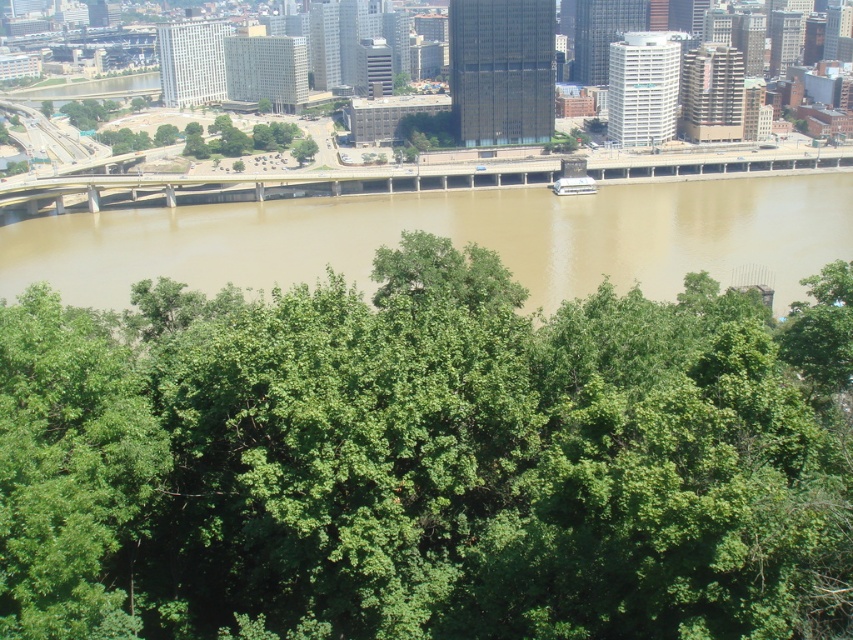
Does point (281, 596) come in front of point (691, 179)?

Yes, it is in front of point (691, 179).

Can you confirm if green leafy tree at center is shorter than brown concrete bridge at center?

Incorrect, green leafy tree at center's height does not fall short of brown concrete bridge at center's.

Does point (556, 490) lie behind point (378, 180)?

That is False.

The width and height of the screenshot is (853, 640). What are the coordinates of `green leafy tree at center` in the screenshot? It's located at (427, 460).

Who is lower down, brown muddy water at center or brown concrete bridge at center?

brown muddy water at center is lower down.

Does brown muddy water at center have a lesser width compared to brown concrete bridge at center?

Indeed, brown muddy water at center has a lesser width compared to brown concrete bridge at center.

Is point (288, 264) positioned behind point (291, 182)?

No, (288, 264) is closer to viewer.

At what (x,y) coordinates should I click in order to perform the action: click on brown muddy water at center. Please return your answer as a coordinate pair (x, y). The image size is (853, 640). Looking at the image, I should click on (451, 237).

Between green leafy tree at center and brown muddy water at center, which one has less height?

With less height is brown muddy water at center.

Between point (729, 376) and point (776, 182), which one is positioned in front?

Point (729, 376) is more forward.

The width and height of the screenshot is (853, 640). I want to click on green leafy tree at center, so click(x=427, y=460).